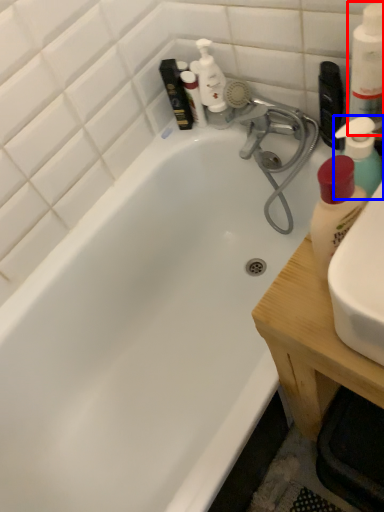
Question: Which object appears closest to the camera in this image, cleaning product (highlighted by a red box) or cleaning product (highlighted by a blue box)?

Choices:
 (A) cleaning product
 (B) cleaning product

Answer: (A)